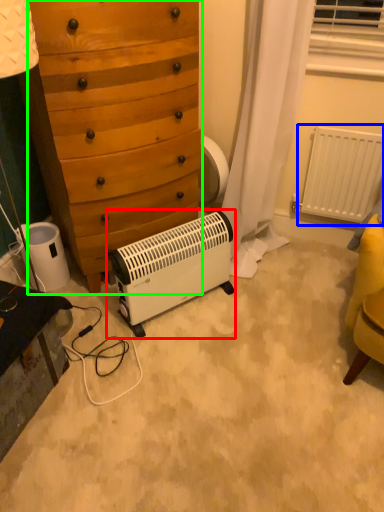
Question: Which object is positioned closest to home appliance (highlighted by a red box)? Select from radiator (highlighted by a blue box) and chest of drawers (highlighted by a green box).

Choices:
 (A) radiator
 (B) chest of drawers

Answer: (B)